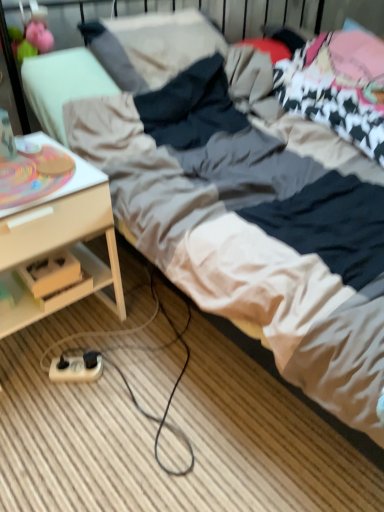
This screenshot has width=384, height=512. What are the coordinates of `empty space that is ontop of white wood desk at lower left (from a real-world perspective)` in the screenshot? It's located at coord(33,167).